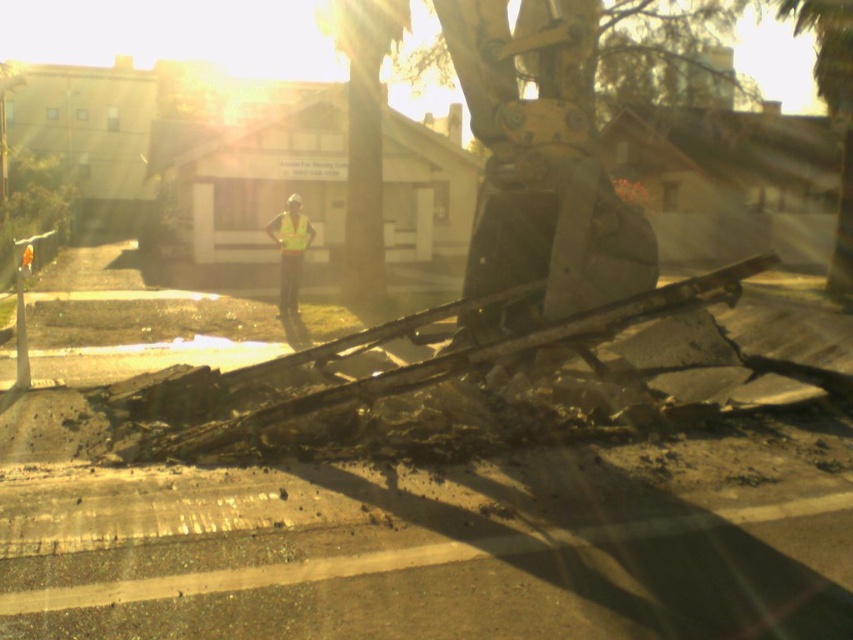
You are a safety inspector at the construction site depicted in the image. You need to ensure that the green leafy tree at center is not in the danger zone. Based on the coordinates provided, can you confirm if the green leafy tree at center is located at point (363, 138)?

Yes, the green leafy tree at center is located at point (363, 138) according to the coordinates provided.

You are a crane operator who needs to move a large beam from the construction site to a storage area. The storage area is located near the green leafy tree at upper right. Your crane has a maximum reach of 12 meters. Can you safely move the beam directly to the storage area without moving the crane, starting from the green leafy tree at center?

The distance between the green leafy tree at center and the green leafy tree at upper right is 13.90 meters. Since the crane can only reach 12 meters, it cannot safely move the beam directly to the storage area without moving the crane.